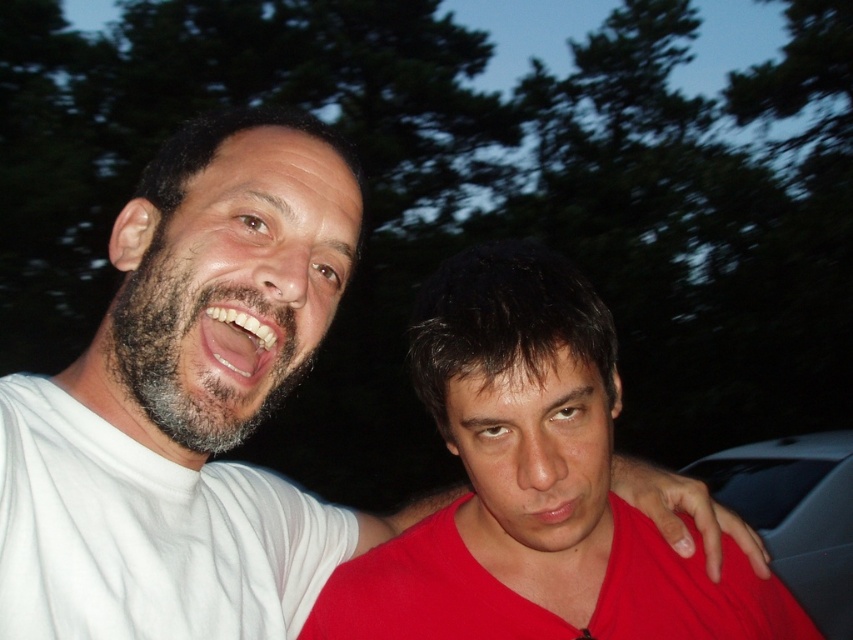
You are a photographer setting up a tripod to capture the two subjects in the image. The matte red shirt at center and the dark gray metallic car at right are both in your frame. Based on their heights, which object should you adjust your tripod height to focus on first to ensure it is in proper focus?

The matte red shirt at center is shorter than the dark gray metallic car at right, so you should adjust the tripod height to focus on the matte red shirt at center first to ensure it is in proper focus.

You are a photographer trying to capture a photo of both the matte red shirt at center and the dark gray metallic car at right. Since you want both subjects to be clearly visible, which object should you focus on first to ensure proper focus, considering their sizes?

The matte red shirt at center has a lesser width compared to the dark gray metallic car at right, so you should focus on the dark gray metallic car at right first because it is larger and will require more precise focusing to ensure clarity.

You are holding a camera and want to take a photo of the matte red shirt at center. The camera has a minimum focusing distance of 30 inches. Can you take a clear photo without moving closer?

A: The matte red shirt at center and camera are 28.46 inches apart, which is less than the minimum focusing distance of 30 inches. Therefore, you cannot take a clear photo without moving further away.